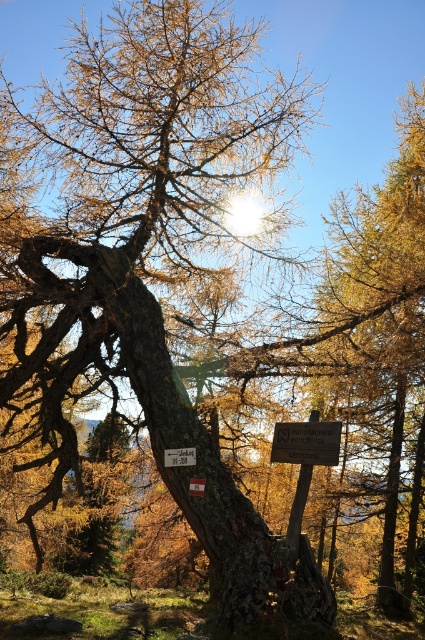
Is point (316, 461) more distant than point (192, 483)?

That is False.

Can you confirm if wooden sign at center is positioned to the left of brown wooden sign at center?

No, wooden sign at center is not to the left of brown wooden sign at center.

Is point (334, 460) positioned in front of point (204, 486)?

Yes, point (334, 460) is closer to viewer.

Locate an element on the screen. The width and height of the screenshot is (425, 640). wooden sign at center is located at coordinates (306, 442).

The image size is (425, 640). Describe the element at coordinates (306, 442) in the screenshot. I see `wooden sign at center` at that location.

Does point (320, 442) come farther from viewer compared to point (166, 451)?

No.

Who is more distant from viewer, (322, 426) or (181, 464)?

Positioned behind is point (181, 464).

Locate an element on the screen. This screenshot has width=425, height=640. wooden sign at center is located at coordinates (306, 442).

Is white plastic sign at center taller than brown wooden sign at center?

Yes.

Is white plastic sign at center further to camera compared to brown wooden sign at center?

Yes, white plastic sign at center is behind brown wooden sign at center.

Which is behind, point (173, 449) or point (204, 484)?

Positioned behind is point (173, 449).

This screenshot has height=640, width=425. I want to click on white plastic sign at center, so click(180, 456).